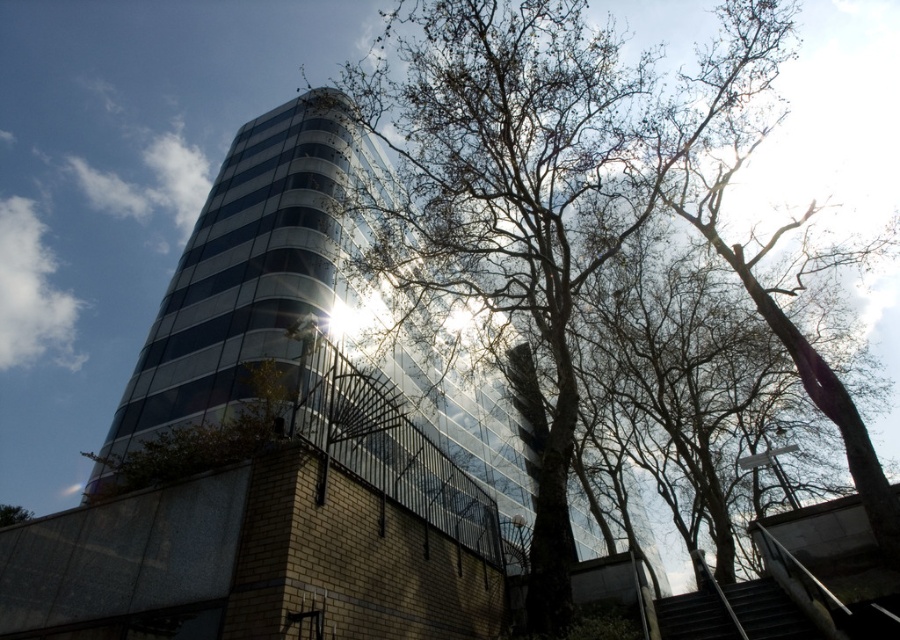
You are standing at the base of the modern cylindrical building and want to reach the viewing platform attached to the yellow brick wall. The path leads past the bare branches at center and the dark gray metal stairs at lower right. Which object would you encounter first as you move towards the platform?

You would first encounter the bare branches at center before the dark gray metal stairs at lower right because the stairs are positioned behind the branches.

You are standing at the base of the modern cylindrical building and want to take a photo of the point marked at coordinates point (532, 16). If your camera has a maximum focus range of 10 meters, will it be able to focus on that point?

The distance of point (532, 16) from camera is 9.78 meters, which is within the camera maximum focus range of 10 meters. Therefore, the camera can focus on that point.